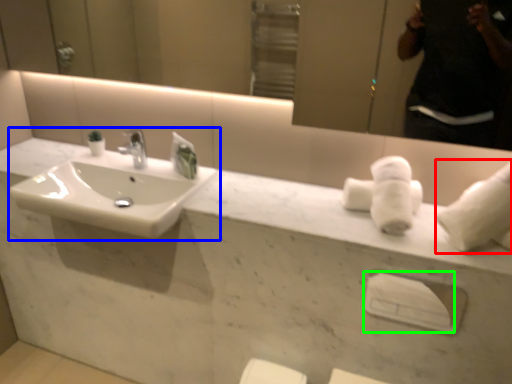
Question: Based on their relative distances, which object is nearer to bath towel (highlighted by a red box)? Choose from sink (highlighted by a blue box) and towel bar (highlighted by a green box).

Choices:
 (A) sink
 (B) towel bar

Answer: (B)